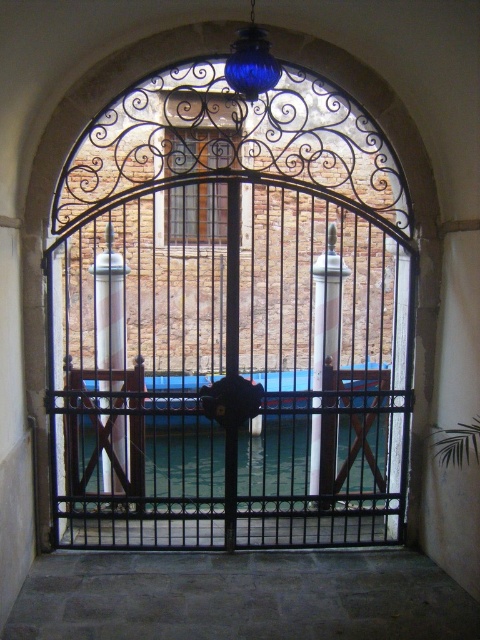
Who is lower down, black metal gate at center or clear glass water at center?

clear glass water at center is lower down.

Is black metal gate at center positioned before clear glass water at center?

That is False.

Who is more distant from viewer, (113, 172) or (339, 432)?

Point (339, 432)

At what (x,y) coordinates should I click in order to perform the action: click on black metal gate at center. Please return your answer as a coordinate pair (x, y). The image size is (480, 640). Looking at the image, I should click on (229, 321).